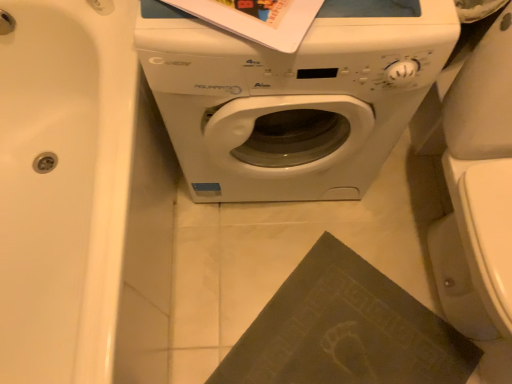
Question: In terms of size, does white glossy washing machine at center appear bigger or smaller than white glossy bathtub at left?

Choices:
 (A) big
 (B) small

Answer: (B)

Question: Does point (456, 29) appear closer or farther from the camera than point (53, 36)?

Choices:
 (A) farther
 (B) closer

Answer: (B)

Question: Which of these objects is positioned closest to the dark matte book at lower right?

Choices:
 (A) white glossy washing machine at center
 (B) white glossy bathtub at left

Answer: (A)

Question: Estimate the real-world distances between objects in this image. Which object is closer to the white glossy bathtub at left?

Choices:
 (A) dark matte book at lower right
 (B) white glossy washing machine at center

Answer: (B)